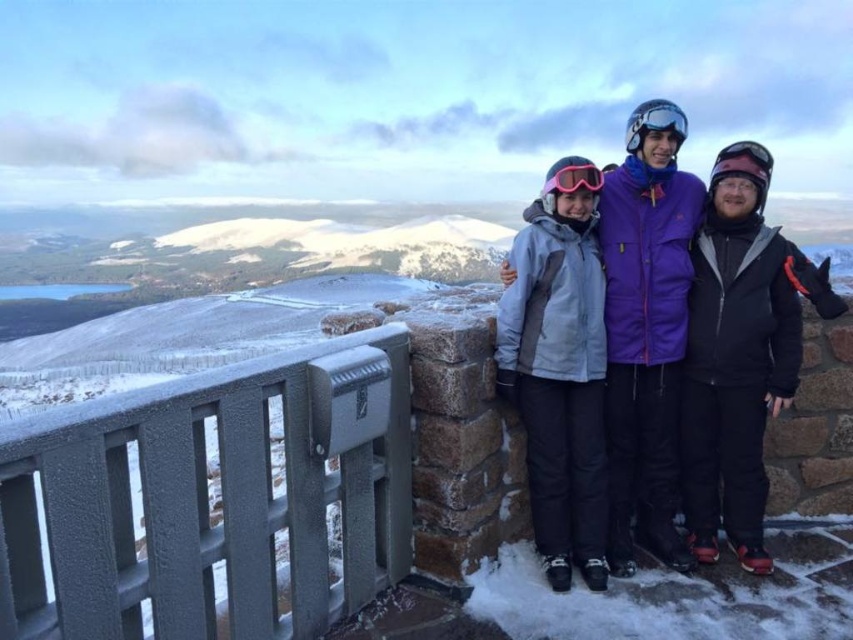
Image resolution: width=853 pixels, height=640 pixels. I want to click on gray plastic rail at left, so pyautogui.click(x=207, y=499).

Is gray plastic rail at left below matte purple jacket at center?

Yes.

Image resolution: width=853 pixels, height=640 pixels. What do you see at coordinates (207, 499) in the screenshot?
I see `gray plastic rail at left` at bounding box center [207, 499].

The image size is (853, 640). In order to click on gray plastic rail at left in this screenshot , I will do `click(207, 499)`.

Who is lower down, matte purple jacket at center or pink matte goggles at center?

pink matte goggles at center

Does point (612, 538) lie in front of point (589, 186)?

No.

The image size is (853, 640). Find the location of `matte purple jacket at center`. matte purple jacket at center is located at coordinates (675, 342).

Does gray plastic rail at left appear under pink matte goggles at center?

Indeed, gray plastic rail at left is positioned under pink matte goggles at center.

Between point (33, 625) and point (582, 186), which one is positioned behind?

Point (582, 186)

Locate an element on the screen. The image size is (853, 640). gray plastic rail at left is located at coordinates (207, 499).